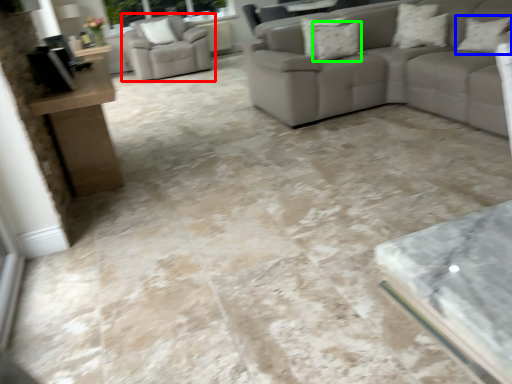
Question: Which object is the closest to the chair (highlighted by a red box)? Choose among these: pillow (highlighted by a blue box) or pillow (highlighted by a green box).

Choices:
 (A) pillow
 (B) pillow

Answer: (B)